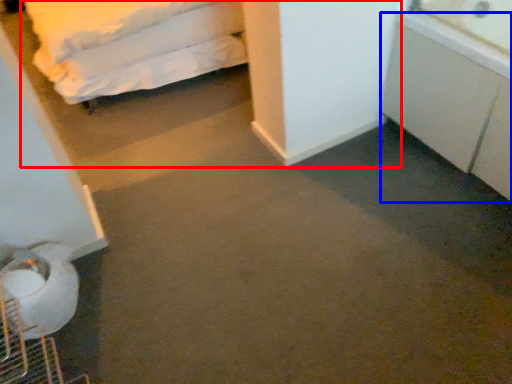
Question: Which object is closer to the camera taking this photo, bed (highlighted by a red box) or cabinetry (highlighted by a blue box)?

Choices:
 (A) bed
 (B) cabinetry

Answer: (B)